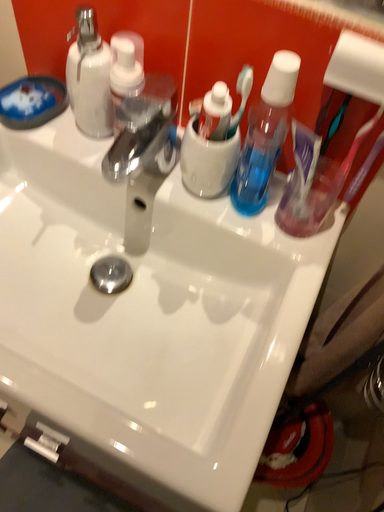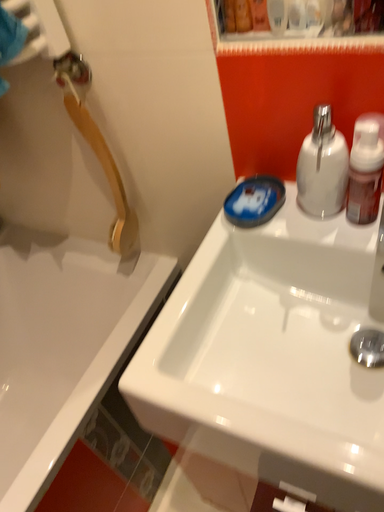
Question: How did the camera likely rotate when shooting the video?

Choices:
 (A) rotated left
 (B) rotated right

Answer: (A)